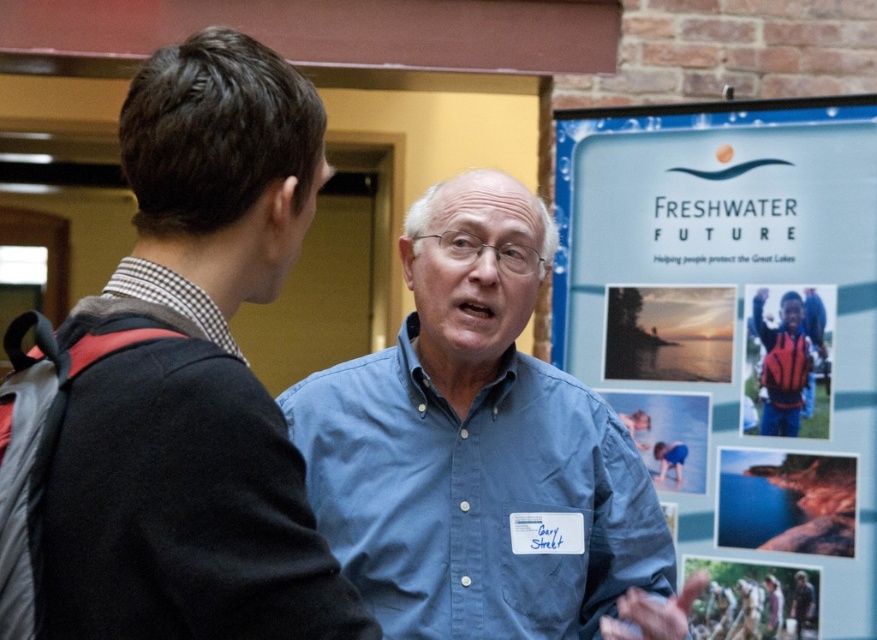
Question: Which point appears farthest from the camera in this image?

Choices:
 (A) (180, 301)
 (B) (693, 396)
 (C) (316, 461)

Answer: (B)

Question: Where is blue button-up shirt at center located in relation to red and black jacket at center in the image?

Choices:
 (A) left
 (B) right

Answer: (A)

Question: Estimate the real-world distances between objects in this image. Which object is farther from the checkered fabric shirt at left?

Choices:
 (A) blue button-up shirt at center
 (B) red and black jacket at center
 (C) blue paperboard at right
 (D) blue button-down shirt at center

Answer: (B)

Question: Based on their relative distances, which object is nearer to the blue button-down shirt at center?

Choices:
 (A) red and black jacket at center
 (B) blue paperboard at right
 (C) blue button-up shirt at center

Answer: (C)

Question: Does blue button-up shirt at center appear under blue button-down shirt at center?

Choices:
 (A) yes
 (B) no

Answer: (B)

Question: Can you confirm if blue button-down shirt at center is wider than red and black jacket at center?

Choices:
 (A) no
 (B) yes

Answer: (B)